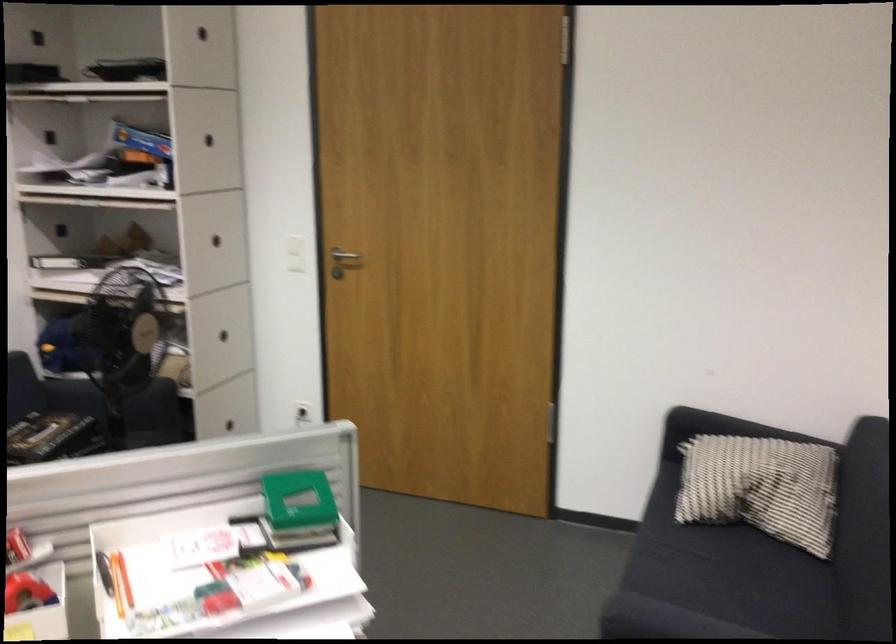
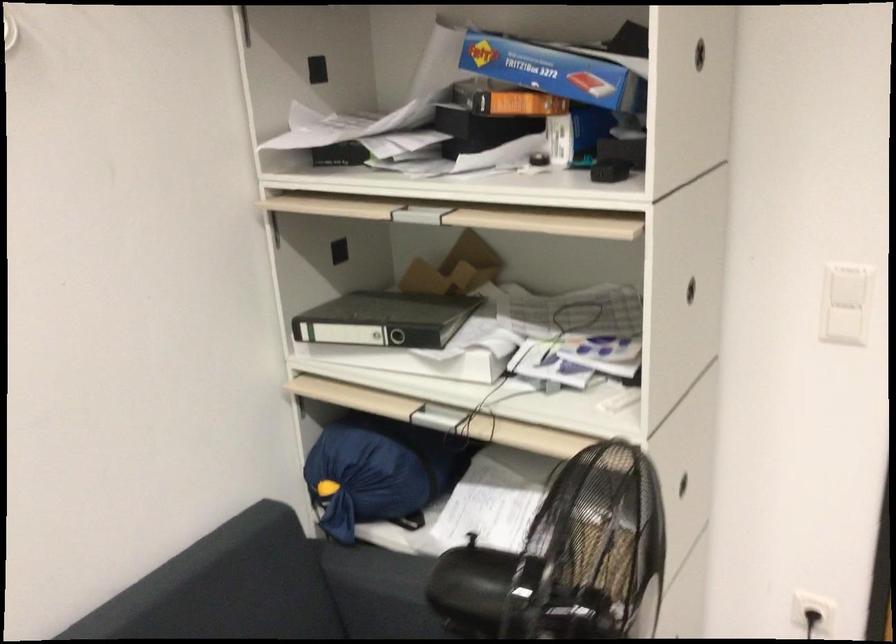
Find the pixel in the second image that matches the point at 152,140 in the first image.

(553, 71)